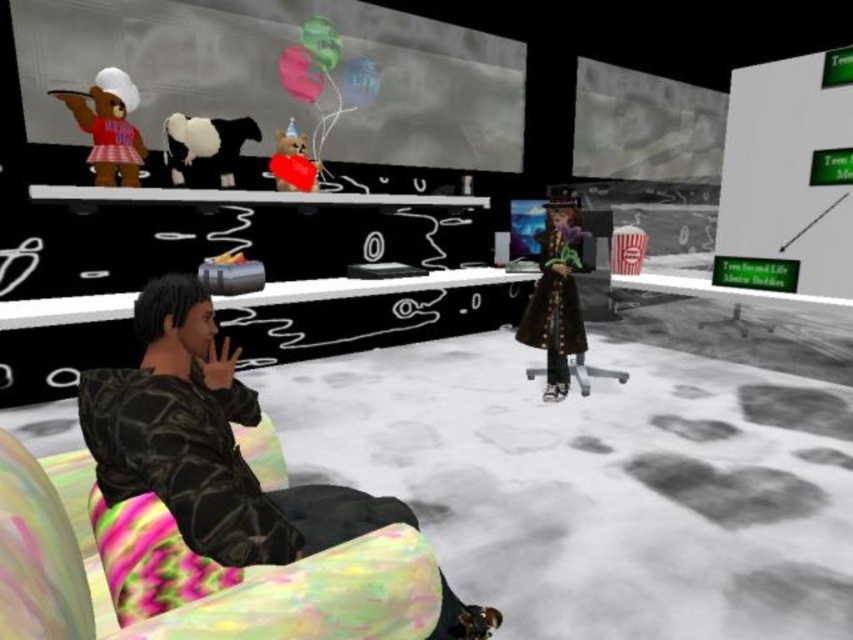
You are navigating a virtual environment and need to locate the camouflage jacket at left. According to the coordinate system where the bottom left corner is the origin, what are its coordinates?

The camouflage jacket at left is located at coordinates point (206, 444).

You are a virtual assistant in this environment. You need to reach an object located above the velvet brown coat at center. Can you first pass through the area where the camouflage jacket at left is located?

The camouflage jacket at left is positioned under the velvet brown coat at center, so yes, you can pass through the area where the camouflage jacket at left is located to reach the object above the velvet brown coat at center.

You are organizing a virtual fashion show and need to arrange the camouflage jacket at left and the velvet brown coat at center based on their sizes. Which coat should be placed first in the order from smallest to largest?

The camouflage jacket at left should be placed first because it has a smaller size compared to the velvet brown coat at center.